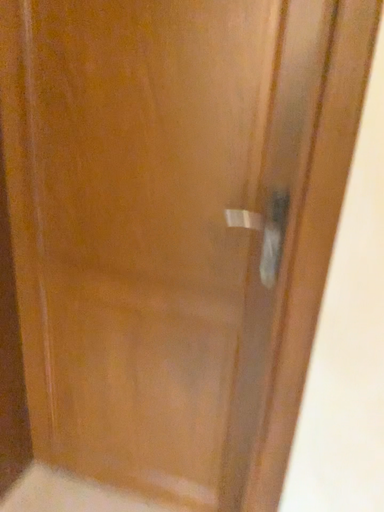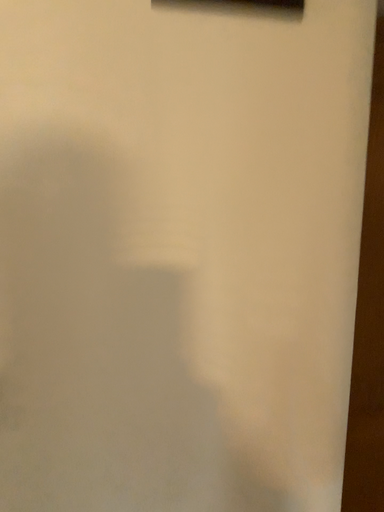
Question: How did the camera likely rotate when shooting the video?

Choices:
 (A) rotated upward
 (B) rotated downward

Answer: (A)